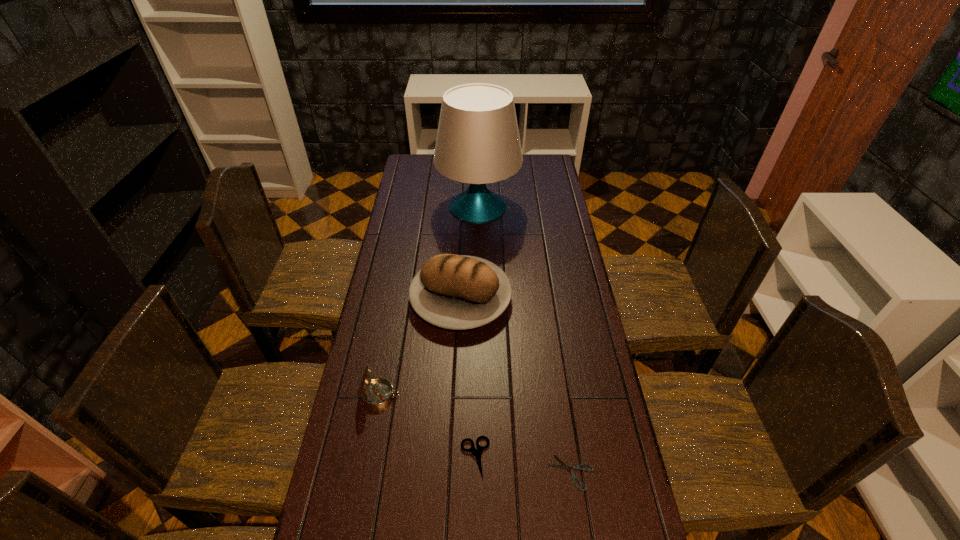
Locate an element on the screen. The image size is (960, 540). object that is the third nearest to the left shears is located at coordinates (458, 292).

At what (x,y) coordinates should I click in order to perform the action: click on vacant space that satisfies the following two spatial constraints: 1. with the dial facing the third farthest object; 2. on the right side of the second shortest object. Please return your answer as a coordinate pair (x, y). The width and height of the screenshot is (960, 540). Looking at the image, I should click on (369, 457).

I want to click on vacant space that satisfies the following two spatial constraints: 1. on the back side of the shortest object; 2. with the dial facing the third nearest object, so click(560, 395).

The image size is (960, 540). What are the coordinates of `blank area in the image that satisfies the following two spatial constraints: 1. with the dial facing the third nearest object; 2. on the left side of the taller shears` in the screenshot? It's located at pyautogui.click(x=369, y=457).

Find the location of a particular element. The image size is (960, 540). vacant space that satisfies the following two spatial constraints: 1. on the front-facing side of the table lamp; 2. with the dial facing the third tallest object is located at coordinates (477, 395).

The width and height of the screenshot is (960, 540). In order to click on vacant space that satisfies the following two spatial constraints: 1. on the front-facing side of the tallest object; 2. on the right side of the right shears in this screenshot , I will do `click(477, 472)`.

What are the coordinates of `vacant space that satisfies the following two spatial constraints: 1. on the front-facing side of the table lamp; 2. on the right side of the shortest object` in the screenshot? It's located at (477, 472).